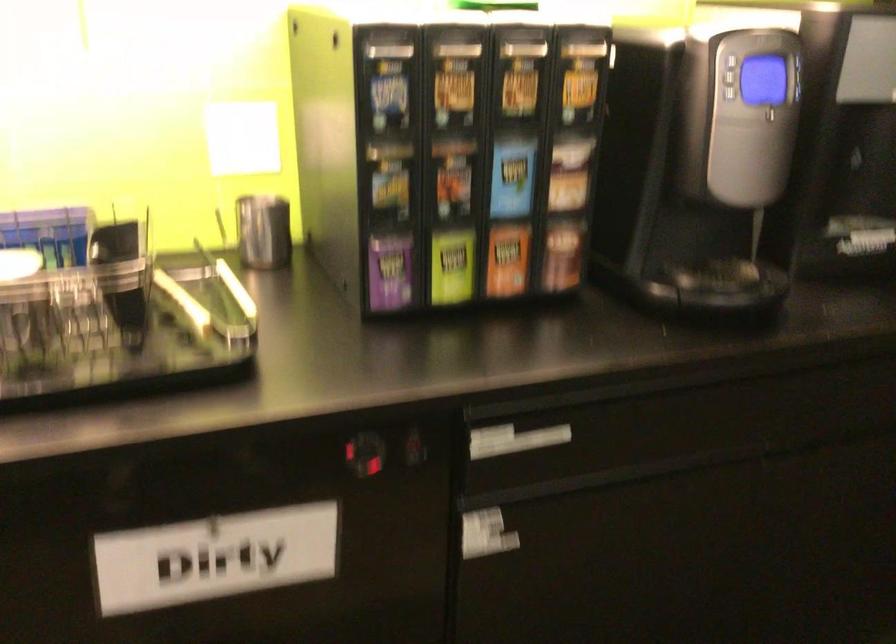
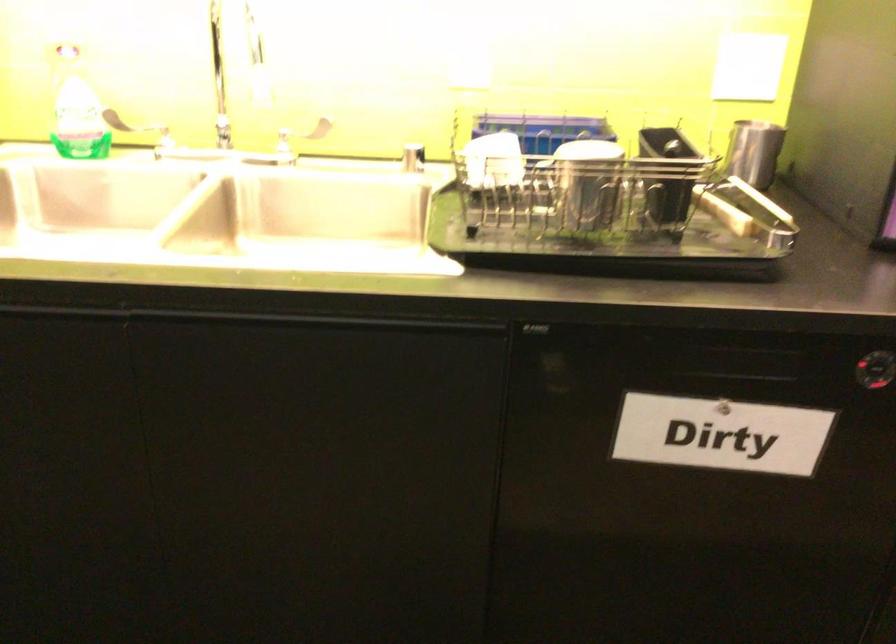
Question: The camera is either moving clockwise (left) or counter-clockwise (right) around the object. The first image is from the beginning of the video and the second image is from the end. Is the camera moving left or right when shooting the video?

Choices:
 (A) Left
 (B) Right

Answer: (B)